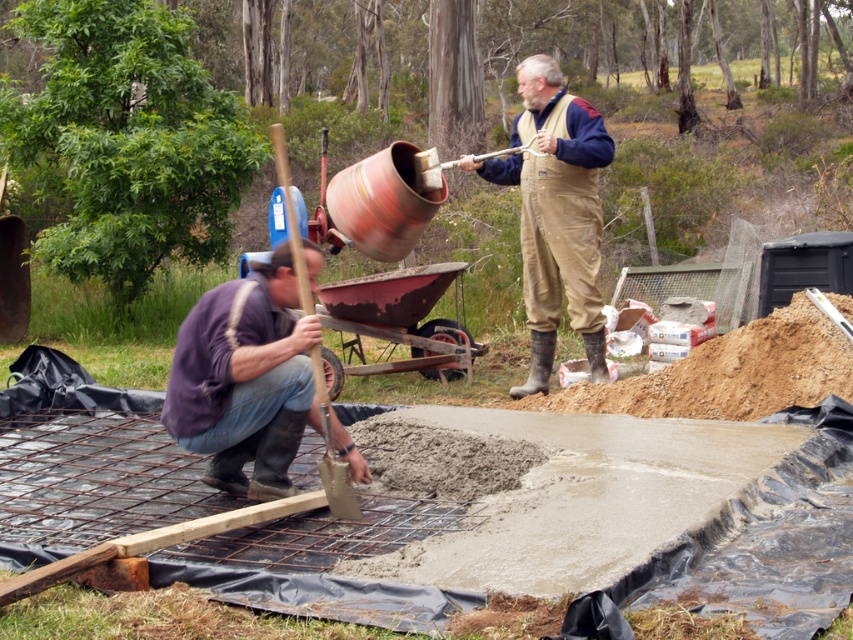
Between matte purple shirt at lower left and brown wooden shovel at lower left, which one is positioned higher?

brown wooden shovel at lower left is higher up.

Based on the photo, does matte purple shirt at lower left have a larger size compared to brown wooden shovel at lower left?

No, matte purple shirt at lower left is not bigger than brown wooden shovel at lower left.

Which is in front, point (251, 410) or point (328, 454)?

Point (251, 410) is more forward.

Locate an element on the screen. The image size is (853, 640). matte purple shirt at lower left is located at coordinates (244, 380).

Consider the image. Is matte purple shirt at lower left positioned behind brown/canvas overalls at center?

No, matte purple shirt at lower left is in front of brown/canvas overalls at center.

Does matte purple shirt at lower left appear on the left side of brown/canvas overalls at center?

Indeed, matte purple shirt at lower left is positioned on the left side of brown/canvas overalls at center.

In order to click on matte purple shirt at lower left in this screenshot , I will do `click(244, 380)`.

The width and height of the screenshot is (853, 640). Find the location of `matte purple shirt at lower left`. matte purple shirt at lower left is located at coordinates (244, 380).

Who is more forward, (524, 186) or (339, 513)?

Point (339, 513)

Looking at this image, who is shorter, brown/canvas overalls at center or brown wooden shovel at lower left?

brown/canvas overalls at center is shorter.

Locate an element on the screen. brown/canvas overalls at center is located at coordinates (555, 214).